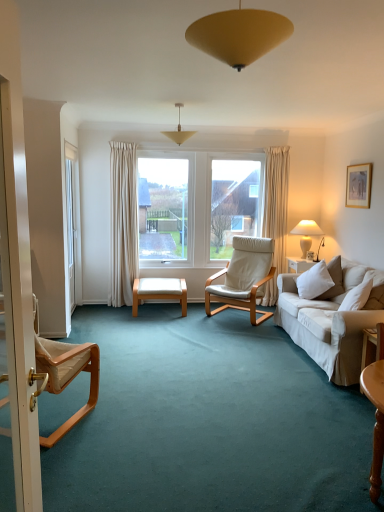
Question: Is white ceramic lamp at right, acting as the 3th lamp starting from the left, to the left of white soft cushion at right from the viewer's perspective?

Choices:
 (A) yes
 (B) no

Answer: (B)

Question: Is white ceramic lamp at right, the third lamp in the top-to-bottom sequence, smaller than white soft cushion at right?

Choices:
 (A) yes
 (B) no

Answer: (A)

Question: Is white soft cushion at right at the back of white ceramic lamp at right, the 1th lamp in the right-to-left sequence?

Choices:
 (A) yes
 (B) no

Answer: (B)

Question: Can you confirm if white ceramic lamp at right, placed as the first lamp when sorted from bottom to top, is taller than white soft cushion at right?

Choices:
 (A) yes
 (B) no

Answer: (A)

Question: From a real-world perspective, is white ceramic lamp at right, the 1th lamp in the right-to-left sequence, located higher than white soft cushion at right?

Choices:
 (A) yes
 (B) no

Answer: (A)

Question: Does point (314, 266) appear closer or farther from the camera than point (218, 272)?

Choices:
 (A) farther
 (B) closer

Answer: (B)

Question: From the image's perspective, relative to white leather chair at center, which is counted as the second chair, starting from the front, is white soft cushion at right above or below?

Choices:
 (A) below
 (B) above

Answer: (A)

Question: Visually, is white soft cushion at right positioned to the left or to the right of white leather chair at center, the first chair when ordered from back to front?

Choices:
 (A) left
 (B) right

Answer: (B)

Question: Is white soft cushion at right spatially inside white leather chair at center, which is counted as the second chair, starting from the front, or outside of it?

Choices:
 (A) outside
 (B) inside

Answer: (A)

Question: Is matte white screen door at left, the second screen door from the back, inside the boundaries of light brown wood chair at left, which appears as the 1th chair when viewed from the left, or outside?

Choices:
 (A) inside
 (B) outside

Answer: (B)

Question: Based on their sizes in the image, would you say matte white screen door at left, placed as the first screen door when sorted from right to left, is bigger or smaller than light brown wood chair at left, the first chair from the front?

Choices:
 (A) big
 (B) small

Answer: (B)

Question: In terms of width, does matte white screen door at left, the second screen door from the back, look wider or thinner when compared to light brown wood chair at left, the first chair from the front?

Choices:
 (A) thin
 (B) wide

Answer: (A)

Question: From the image's perspective, is matte white screen door at left, which appears as the 2th screen door when viewed from the left, located above or below light brown wood chair at left, the first chair from the front?

Choices:
 (A) above
 (B) below

Answer: (A)

Question: Is matte yellow pendant light at upper center, which is the first lamp in left-to-right order, taller or shorter than white leather chair at center, which is the 1th chair from right to left?

Choices:
 (A) tall
 (B) short

Answer: (B)

Question: Is matte yellow pendant light at upper center, which is the first lamp in left-to-right order, bigger or smaller than white leather chair at center, which is the 1th chair from right to left?

Choices:
 (A) small
 (B) big

Answer: (A)